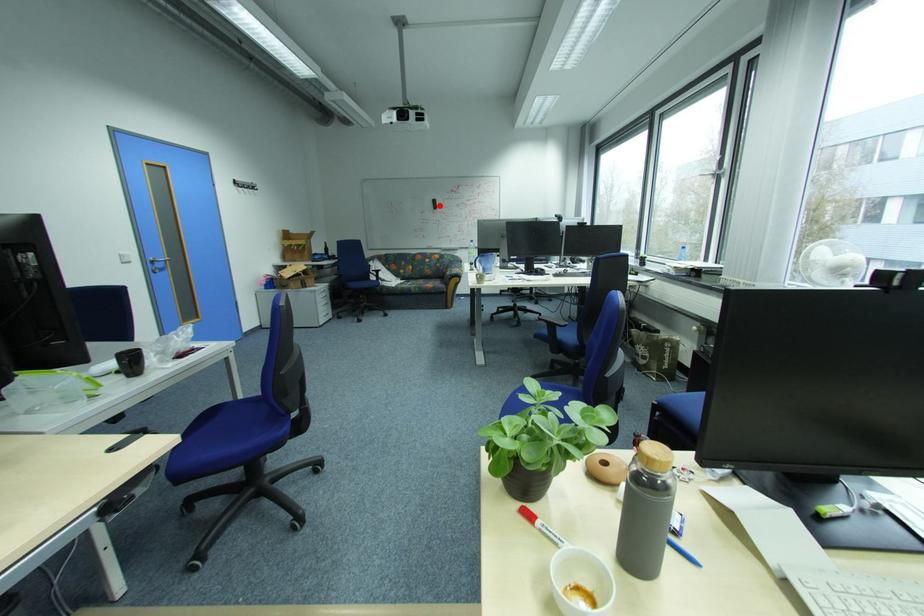
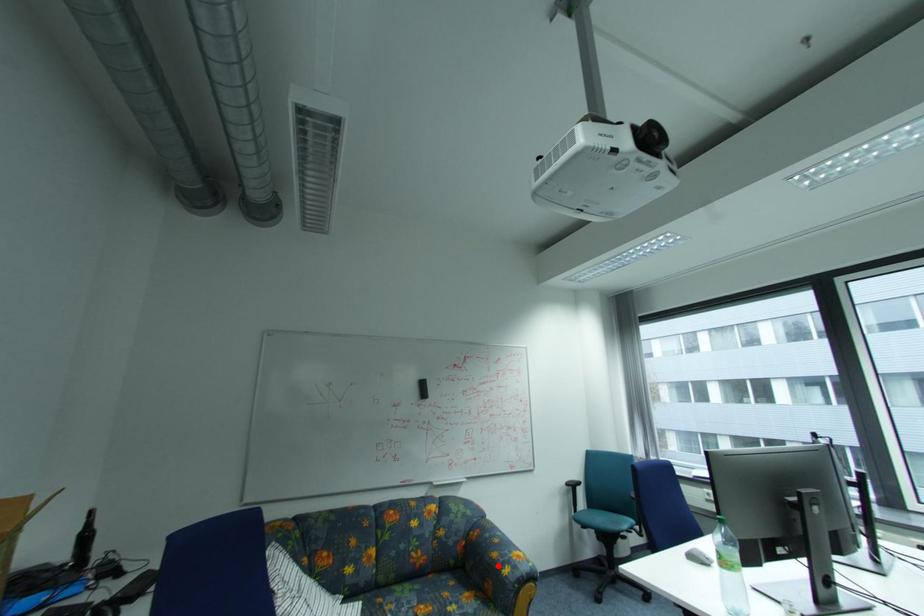
I am providing you with two images of the same scene from different viewpoints. A red point is marked on the first image and another point is marked on the second image. Do the highlighted points in image1 and image2 indicate the same real-world spot?

No